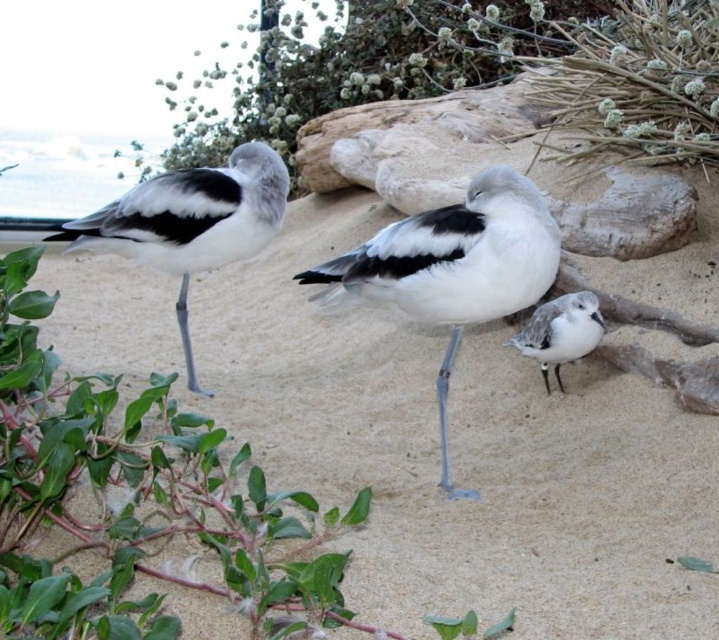
Who is taller, green leafy plant at upper center or white matte bird at left?

Standing taller between the two is green leafy plant at upper center.

Which is more to the right, green leafy plant at upper center or white matte bird at left?

green leafy plant at upper center is more to the right.

Where is `green leafy plant at upper center`? The width and height of the screenshot is (719, 640). green leafy plant at upper center is located at coordinates coord(472,77).

How far apart are green leafy plant at upper center and white matte bird at center?

They are 7.08 feet apart.

Does green leafy plant at upper center appear on the right side of white matte bird at center?

Incorrect, green leafy plant at upper center is not on the right side of white matte bird at center.

Who is more distant from viewer, (505, 68) or (521, 234)?

The point (505, 68) is behind.

Where is `green leafy plant at upper center`? The height and width of the screenshot is (640, 719). green leafy plant at upper center is located at coordinates pyautogui.click(x=472, y=77).

Based on the photo, who is taller, white matte bird at center or white matte/sand-colored bird at lower right?

white matte bird at center is taller.

Between point (453, 314) and point (559, 316), which one is positioned in front?

Point (453, 314)

The width and height of the screenshot is (719, 640). In order to click on white matte bird at center in this screenshot , I will do `click(453, 268)`.